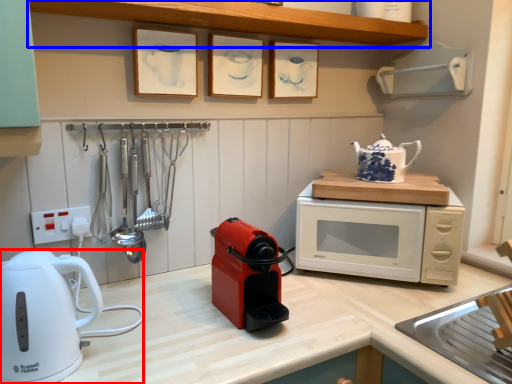
Question: Which point is closer to the camera, home appliance (highlighted by a red box) or shelf (highlighted by a blue box)?

Choices:
 (A) home appliance
 (B) shelf

Answer: (A)